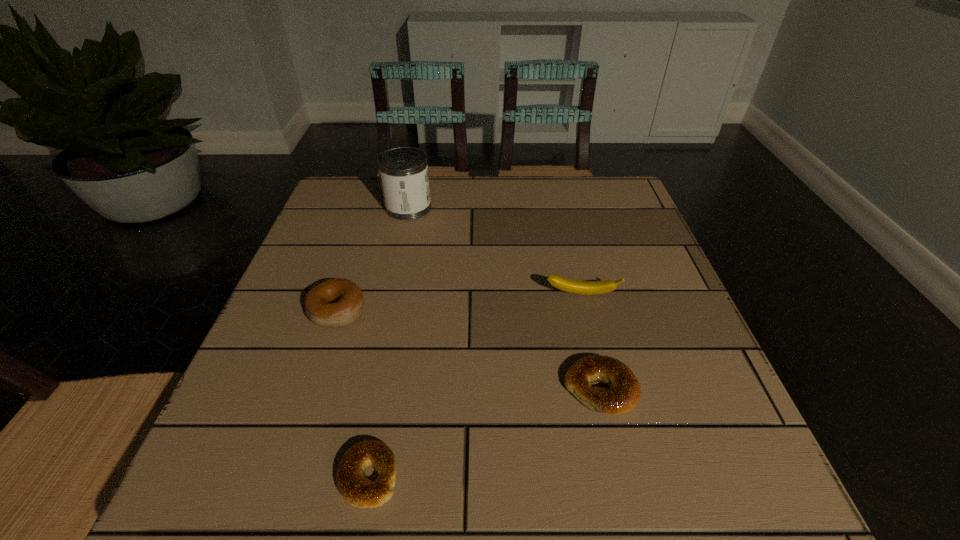
Find the location of `bagel that stands as the second closest to the shortest object`. bagel that stands as the second closest to the shortest object is located at coordinates (624, 391).

Identify which bagel is the second nearest to the second bagel from left to right. Please provide its 2D coordinates. Your answer should be formatted as a tuple, i.e. [(x, y)], where the tuple contains the x and y coordinates of a point satisfying the conditions above.

[(624, 391)]